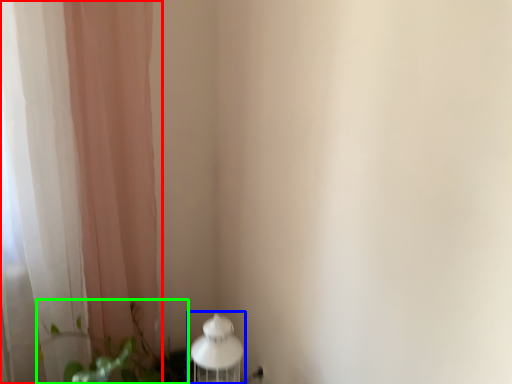
Question: Estimate the real-world distances between objects in this image. Which object is farther from curtain (highlighted by a red box), table lamp (highlighted by a blue box) or plant (highlighted by a green box)?

Choices:
 (A) table lamp
 (B) plant

Answer: (A)